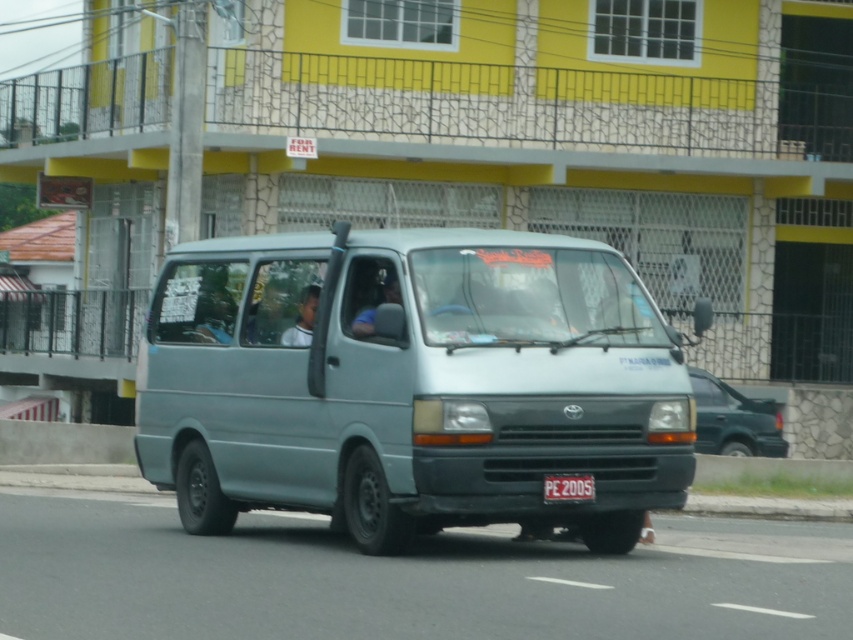
Is green matte suv at right taller than matte blue shirt at center?

Yes, green matte suv at right is taller than matte blue shirt at center.

Can you confirm if green matte suv at right is positioned below matte blue shirt at center?

Correct, green matte suv at right is located below matte blue shirt at center.

Is point (750, 435) more distant than point (306, 321)?

Yes, point (750, 435) is behind point (306, 321).

Locate an element on the screen. The width and height of the screenshot is (853, 640). green matte suv at right is located at coordinates (734, 419).

Between light blue matte van at center and matte blue shirt at center, which one appears on the left side from the viewer's perspective?

Positioned to the left is matte blue shirt at center.

The image size is (853, 640). I want to click on light blue matte van at center, so click(x=412, y=384).

Identify the location of light blue matte van at center. Image resolution: width=853 pixels, height=640 pixels. (412, 384).

What do you see at coordinates (412, 384) in the screenshot? I see `light blue matte van at center` at bounding box center [412, 384].

Does light blue matte van at center appear under white plastic license plate at center?

Actually, light blue matte van at center is above white plastic license plate at center.

This screenshot has height=640, width=853. I want to click on light blue matte van at center, so click(x=412, y=384).